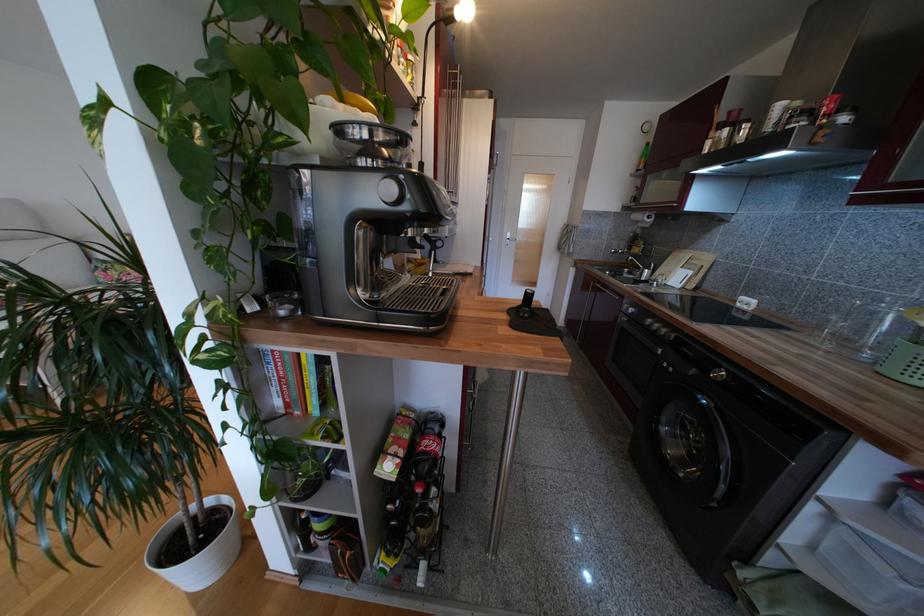
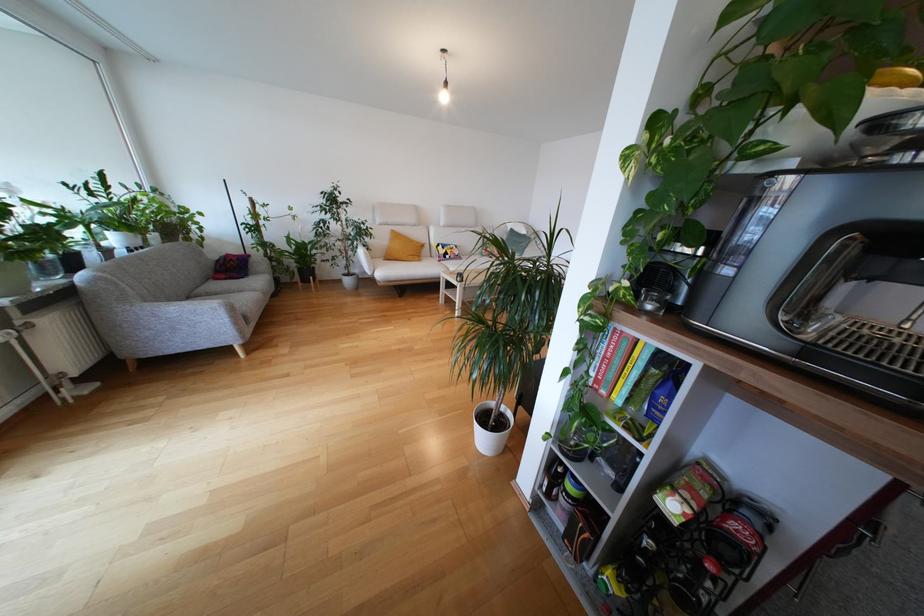
Where in the second image is the point corresponding to the point at 434,443 from the first image?

(750, 533)